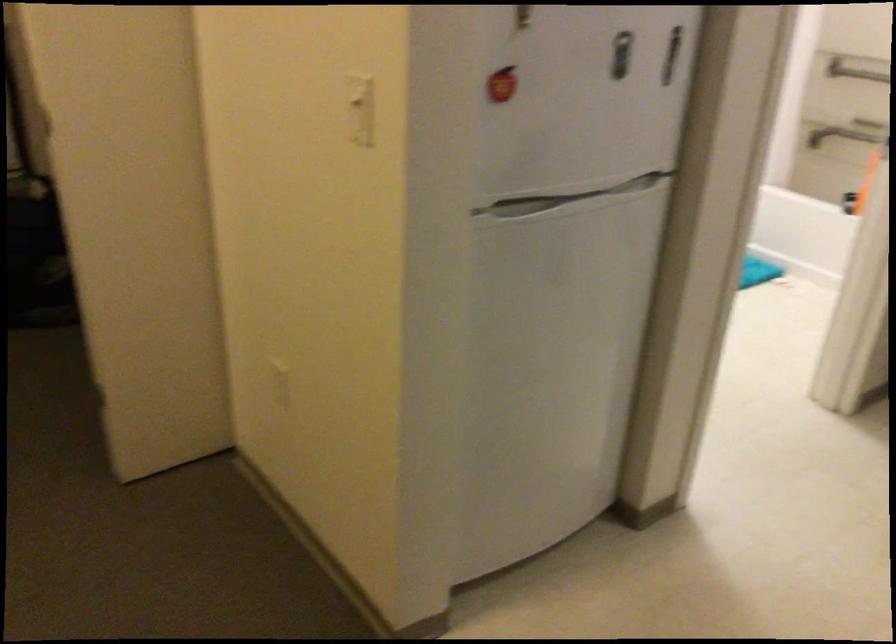
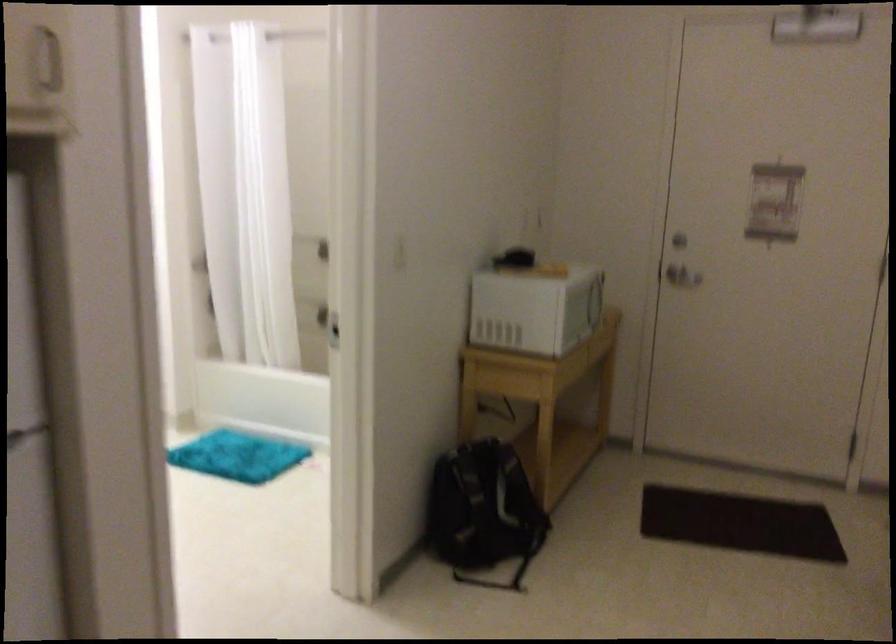
Where in the second image is the point corresponding to the point at 797,129 from the first image?

(312, 310)